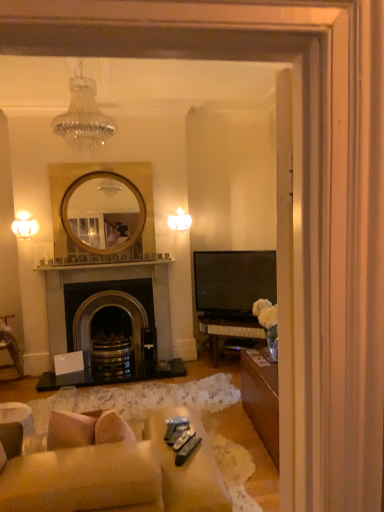
Question: Is metallic silver remote control at lower center, placed as the second remote control when sorted from front to back, bigger or smaller than clear glass chandelier at upper center, the third lamp ordered from the bottom?

Choices:
 (A) big
 (B) small

Answer: (B)

Question: From the image's perspective, is metallic silver remote control at lower center, positioned as the second remote control in back-to-front order, located above or below clear glass chandelier at upper center, the third lamp ordered from the bottom?

Choices:
 (A) below
 (B) above

Answer: (A)

Question: Which object is the closest to the matte white lampshade at upper center, the first lamp viewed from the back?

Choices:
 (A) dark gray stone fireplace at center
 (B) matte white sconce at left, arranged as the 1th lamp when viewed from the left
 (C) black plastic remote control at lower center, which is counted as the first remote control, starting from the back
 (D) metallic silver remote control at lower center, placed as the second remote control when sorted from front to back
 (E) metallic gray remote control at lower center, the 3th remote control from the back

Answer: (A)

Question: Which of these objects is positioned closest to the matte white sconce at left, positioned as the third lamp in top-to-bottom order?

Choices:
 (A) dark gray stone fireplace at center
 (B) black plastic remote control at lower center, the 3th remote control from the front
 (C) clear glass chandelier at upper center, the first lamp in the top-to-bottom sequence
 (D) matte white lampshade at upper center, positioned as the third lamp in left-to-right order
 (E) metallic gray remote control at lower center, the 3th remote control from the back

Answer: (A)